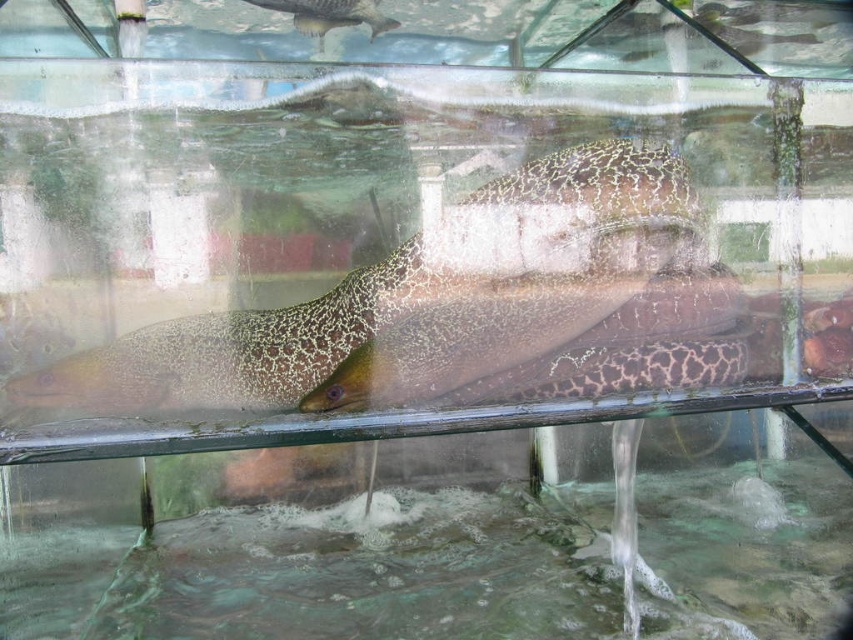
Based on the scene, which object occupies more vertical space in the image? Please consider the clear water at bottom and the shiny silver fish at upper center in your answer.

The clear water at bottom has a greater height compared to the shiny silver fish at upper center, so the clear water at bottom occupies more vertical space in the image.